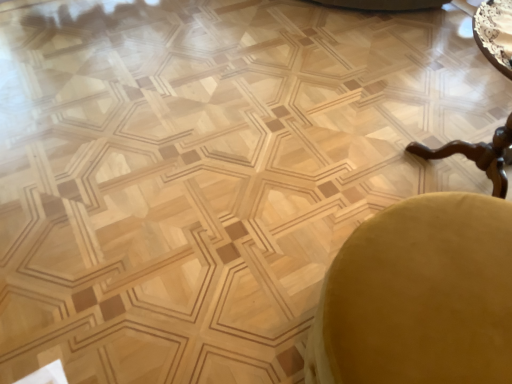
At what (x,y) coordinates should I click in order to perform the action: click on vacant region to the left of wooden polished table at right. Please return your answer as a coordinate pair (x, y). Looking at the image, I should click on (334, 163).